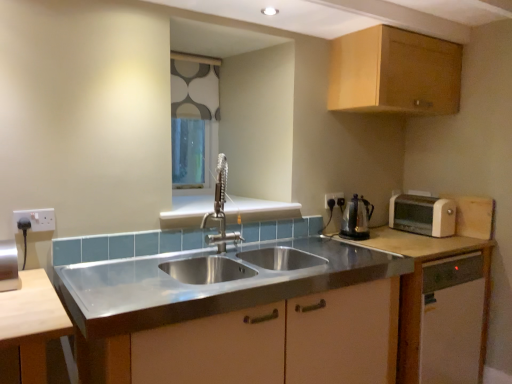
Question: In the image, is white plastic electrical outlet at upper right, which is counted as the first electric outlet, starting from the back, on the left side or the right side of white matte cabinet at right, which appears as the third cabinetry when viewed from the top?

Choices:
 (A) left
 (B) right

Answer: (A)

Question: Is white plastic electrical outlet at upper right, the 2th electric outlet when ordered from front to back, situated inside white matte cabinet at right, which appears as the third cabinetry when viewed from the top, or outside?

Choices:
 (A) outside
 (B) inside

Answer: (A)

Question: Which of these objects is positioned farthest from the white fabric at upper center?

Choices:
 (A) white matte cabinet at right, which appears as the third cabinetry when viewed from the top
 (B) polished stainless steel faucet at center
 (C) shiny metallic kettle at right
 (D) wooden cabinet at upper right, which is the 1th cabinetry from top to bottom
 (E) white plastic electrical outlet at upper right, placed as the first electric outlet when sorted from right to left

Answer: (A)

Question: Estimate the real-world distances between objects in this image. Which object is closer to the white plastic electrical outlet at upper right, which appears as the 2th electric outlet when viewed from the left?

Choices:
 (A) white matte cabinet at right, the first cabinetry from the bottom
 (B) stainless steel sink at center, marked as the 2th cabinetry in a top-to-bottom arrangement
 (C) white fabric at upper center
 (D) shiny metallic kettle at right
 (E) polished stainless steel faucet at center

Answer: (D)